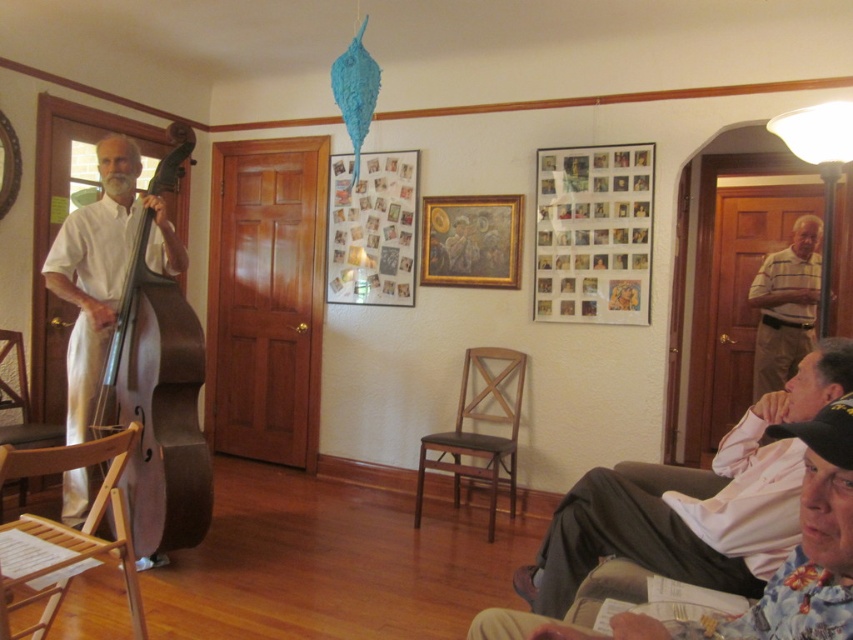
Looking at this image, does matte brown cello at left appear over wooden armchair at left?

Correct, matte brown cello at left is located above wooden armchair at left.

Looking at this image, between matte brown cello at left and wooden armchair at left, which one has less height?

wooden armchair at left

At what (x,y) coordinates should I click in order to perform the action: click on matte brown cello at left. Please return your answer as a coordinate pair (x, y). The width and height of the screenshot is (853, 640). Looking at the image, I should click on (157, 404).

Identify the location of matte brown cello at left. (157, 404).

Can you confirm if brown wood chair at center is positioned to the left of striped cotton shirt at right?

Correct, you'll find brown wood chair at center to the left of striped cotton shirt at right.

Where is `brown wood chair at center`? brown wood chair at center is located at coordinates (479, 433).

You are a GUI agent. You are given a task and a screenshot of the screen. Output one action in this format:
    pyautogui.click(x=<x>, y=<y>)
    Task: Click on the striped cotton shirt at right
    This screenshot has height=640, width=853.
    Given the screenshot: What is the action you would take?
    pyautogui.click(x=785, y=305)

Image resolution: width=853 pixels, height=640 pixels. Describe the element at coordinates (785, 305) in the screenshot. I see `striped cotton shirt at right` at that location.

Is point (780, 336) behind point (25, 429)?

That is True.

I want to click on striped cotton shirt at right, so click(785, 305).